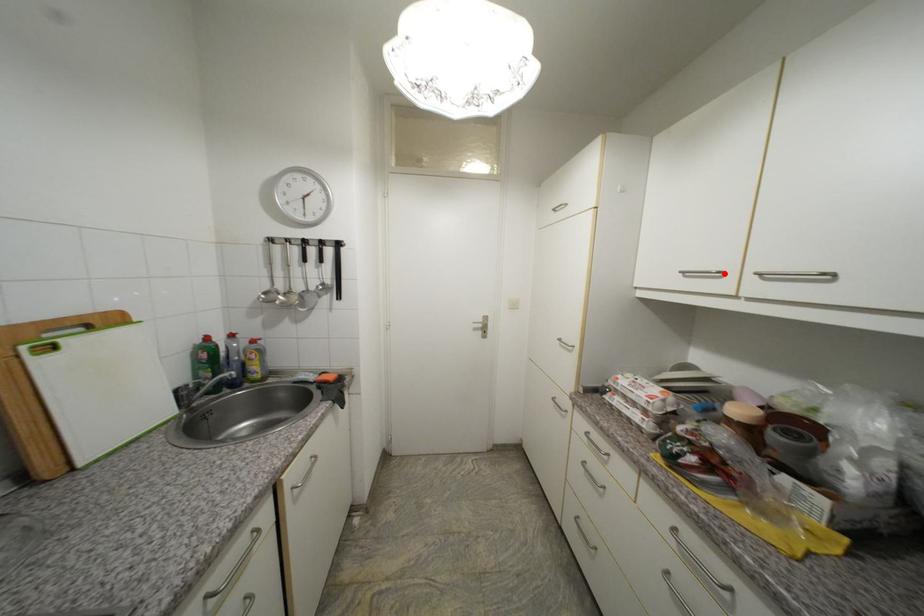
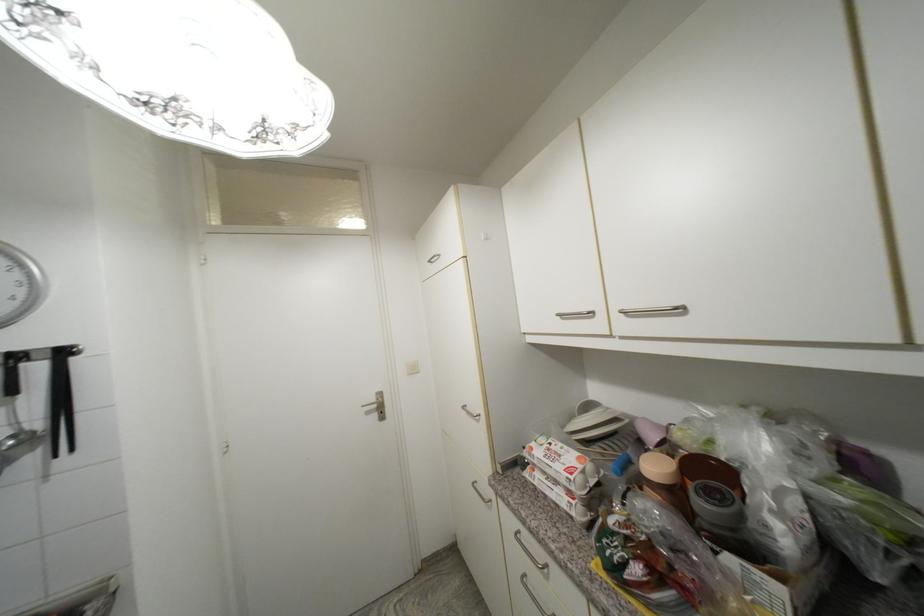
Where in the second image is the point corresponding to the highlighted location from the first image?

(594, 314)